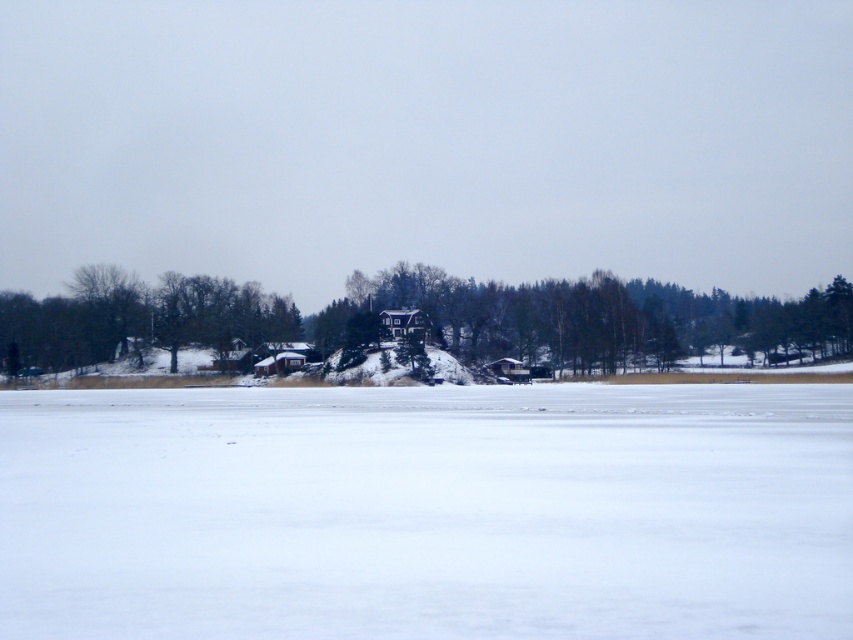
Can you confirm if white matte snow at center is bigger than green matte tree at center?

Actually, white matte snow at center might be smaller than green matte tree at center.

Which is in front, point (585, 474) or point (531, 324)?

Positioned in front is point (585, 474).

Does point (195, 592) come behind point (579, 348)?

No, it is in front of (579, 348).

Where is `white matte snow at center`? white matte snow at center is located at coordinates (427, 512).